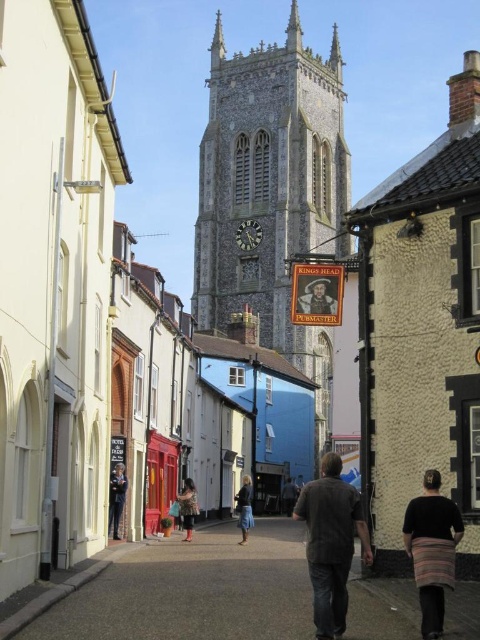
Does dark gray shirt at center have a greater width compared to denim shorts at center?

Yes.

Which is more to the left, dark gray shirt at center or denim shorts at center?

denim shorts at center

What do you see at coordinates (331, 541) in the screenshot? I see `dark gray shirt at center` at bounding box center [331, 541].

Where is `dark gray shirt at center`? dark gray shirt at center is located at coordinates (331, 541).

Is dark gray shirt at center bigger than dark blue jeans at lower left?

Yes.

Does dark gray shirt at center have a lesser width compared to dark blue jeans at lower left?

Incorrect, dark gray shirt at center's width is not less than dark blue jeans at lower left's.

Measure the distance between dark gray shirt at center and camera.

The distance of dark gray shirt at center from camera is 26.91 meters.

Identify the location of dark gray shirt at center. Image resolution: width=480 pixels, height=640 pixels. (331, 541).

What do you see at coordinates (192, 592) in the screenshot?
I see `smooth asphalt alley at center` at bounding box center [192, 592].

Does point (357, 556) lie behind point (116, 532)?

No, it is in front of (116, 532).

Where is `smooth asphalt alley at center`? This screenshot has width=480, height=640. smooth asphalt alley at center is located at coordinates (192, 592).